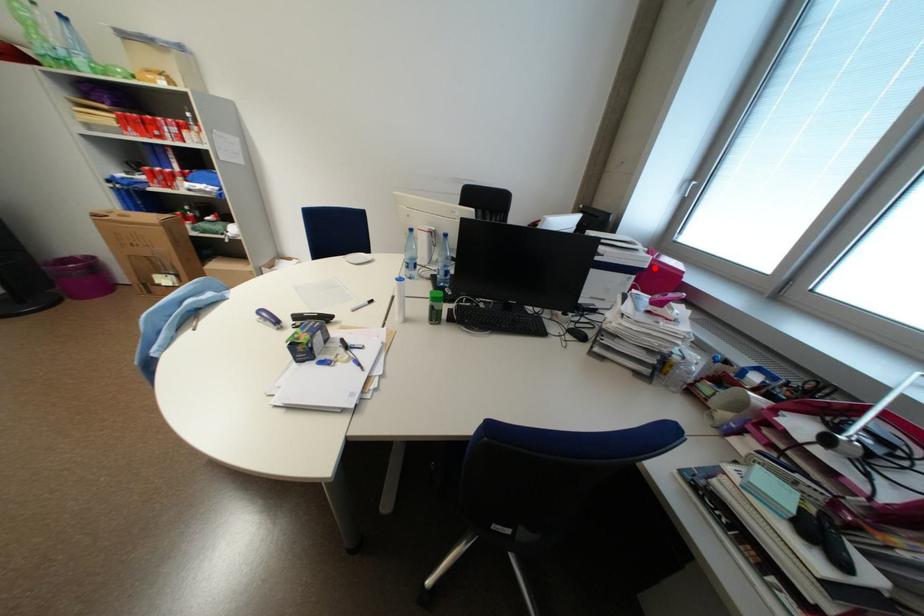
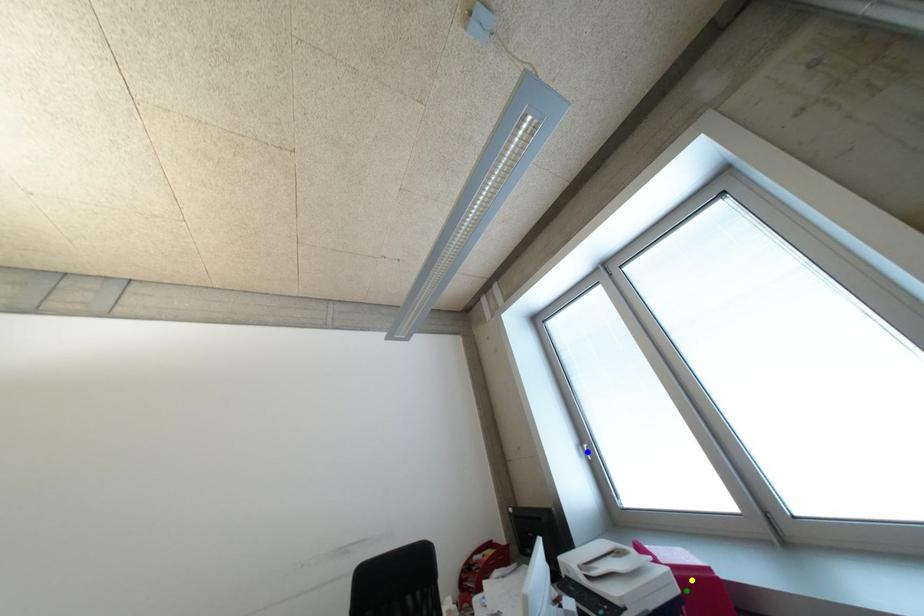
Question: I am providing you with two images of the same scene from different viewpoints. A red point is marked on the first image. You are given multiple points on the second image. Which mark in image 2 goes with the point in image 1?

Choices:
 (A) green point
 (B) yellow point
 (C) blue point

Answer: (A)